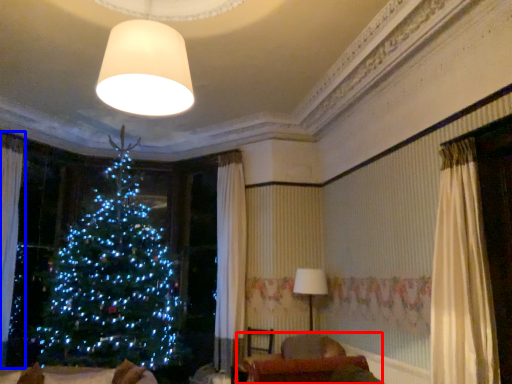
Question: Among these objects, which one is nearest to the camera, furniture (highlighted by a red box) or curtain (highlighted by a blue box)?

Choices:
 (A) furniture
 (B) curtain

Answer: (A)